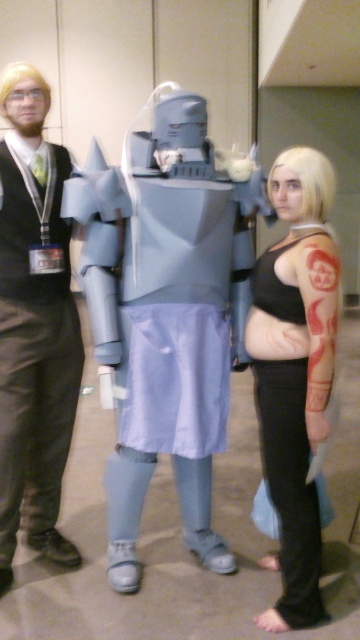
You are a photographer at a convention and need to capture a photo of the brushed metal vest at left and the black matte tank top at center. Which clothing item will appear wider in the photo?

The black matte tank top at center will appear wider in the photo because the brushed metal vest at left has a lesser width compared to it.

Consider the image. You are a photographer at the event and want to capture both the brushed metal vest at left and the black matte tank top at center in a single frame. Which object should you focus on first to ensure both are in the frame?

The brushed metal vest at left is taller than the black matte tank top at center, so you should focus on the taller brushed metal vest at left first to ensure both are in the frame.

You are a photographer at a convention and need to position two attendees so that the distance between the brushed metal vest at left and the black matte tank top at center is exactly 30 inches. Can you adjust their current positions to meet this requirement?

The current distance between the brushed metal vest at left and the black matte tank top at center is 32.73 inches. To achieve the desired 30 inches, you would need to move them closer by approximately 2.73 inches.